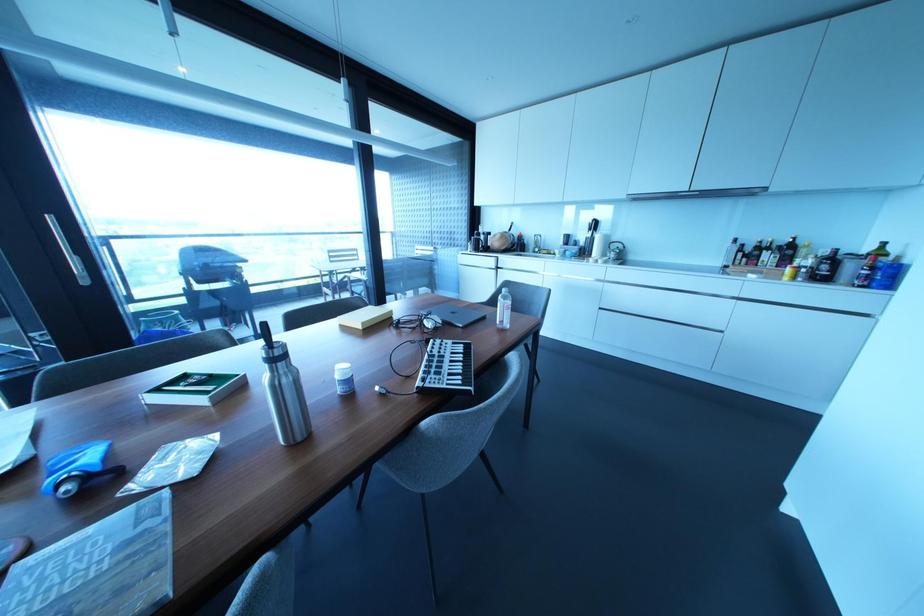
Describe the element at coordinates (274, 334) in the screenshot. Image resolution: width=924 pixels, height=616 pixels. I see `a water bottle handle` at that location.